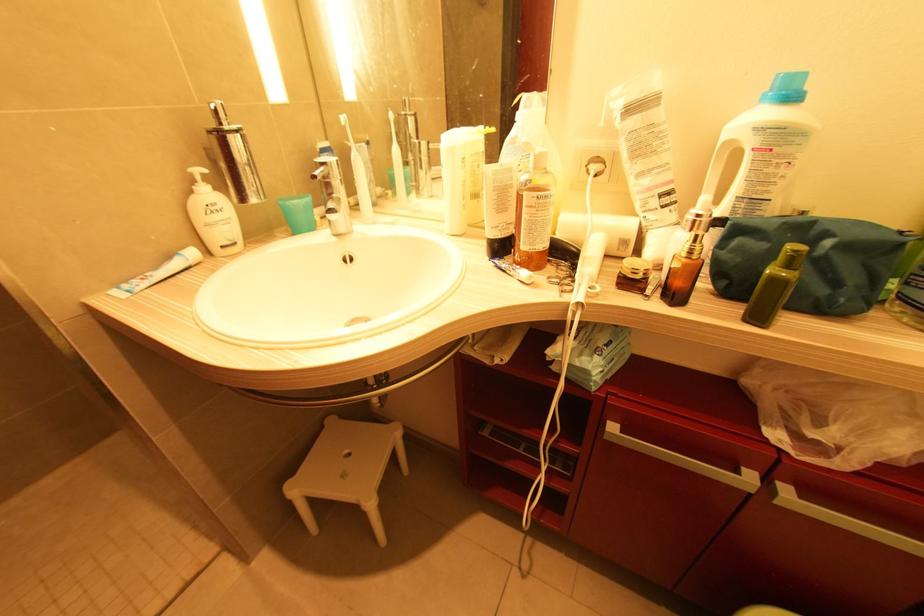
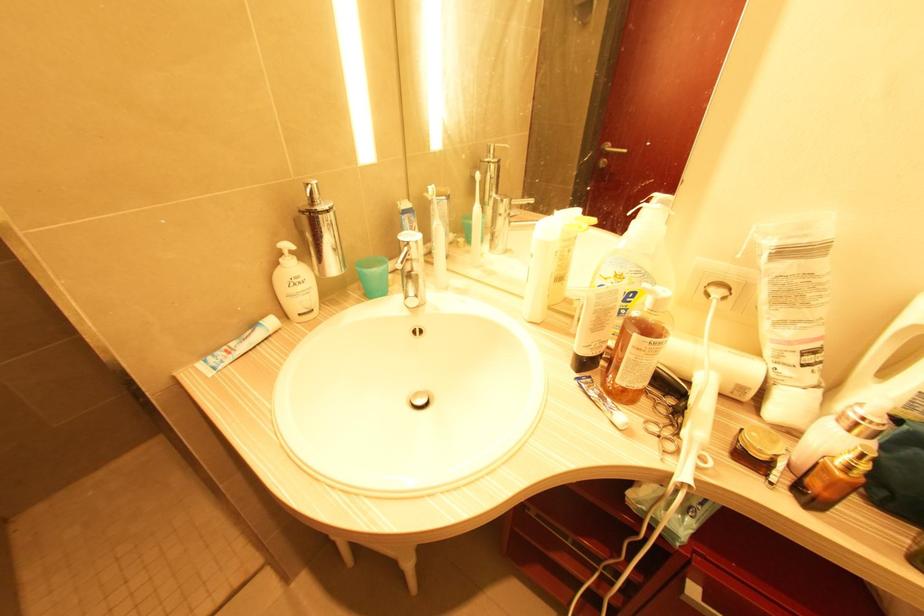
Question: The camera is either moving clockwise (left) or counter-clockwise (right) around the object. The first image is from the beginning of the video and the second image is from the end. Is the camera moving left or right when shooting the video?

Choices:
 (A) Left
 (B) Right

Answer: (B)